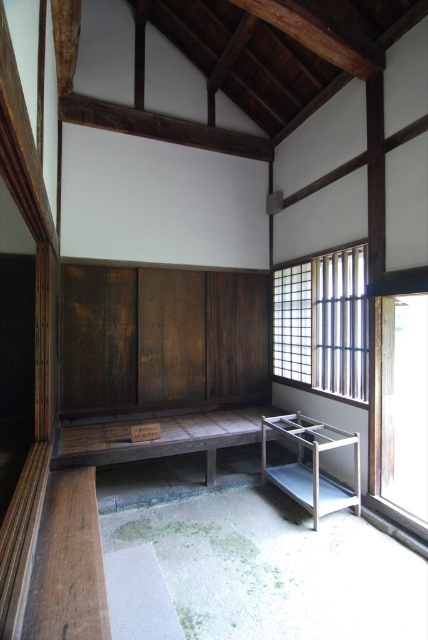
Question: Which object is farther from the camera taking this photo?

Choices:
 (A) metallic silver bench at center
 (B) wooden bench at center

Answer: (B)

Question: Estimate the real-world distances between objects in this image. Which object is farther from the translucent wood window at right?

Choices:
 (A) wooden bench at center
 (B) metallic silver bench at center
 (C) transparent glass window at right

Answer: (A)

Question: In this image, where is wooden bench at center located relative to metallic silver bench at center?

Choices:
 (A) left
 (B) right

Answer: (A)

Question: Considering the relative positions of wooden bench at center and metallic silver bench at center in the image provided, where is wooden bench at center located with respect to metallic silver bench at center?

Choices:
 (A) below
 (B) above

Answer: (B)

Question: Considering the real-world distances, which object is closest to the metallic silver bench at center?

Choices:
 (A) transparent glass window at right
 (B) translucent wood window at right

Answer: (B)

Question: Is transparent glass window at right to the right of metallic silver bench at center from the viewer's perspective?

Choices:
 (A) yes
 (B) no

Answer: (A)